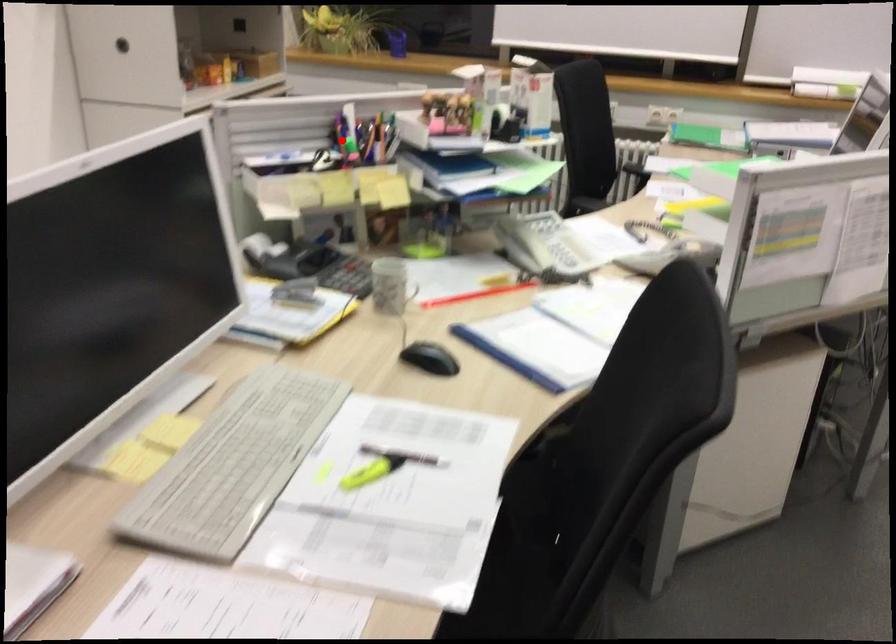
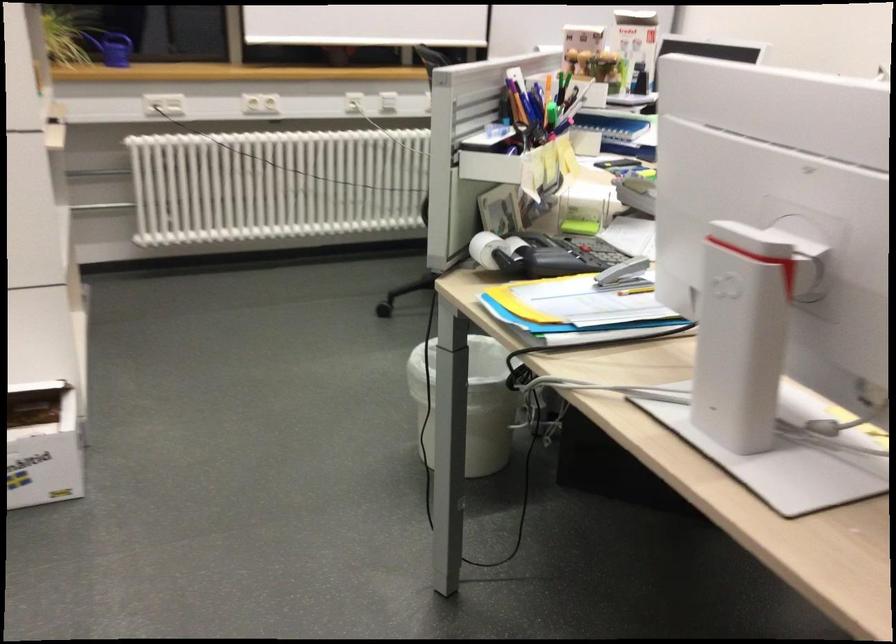
In the second image, find the point that corresponds to the highlighted location in the first image.

(521, 104)